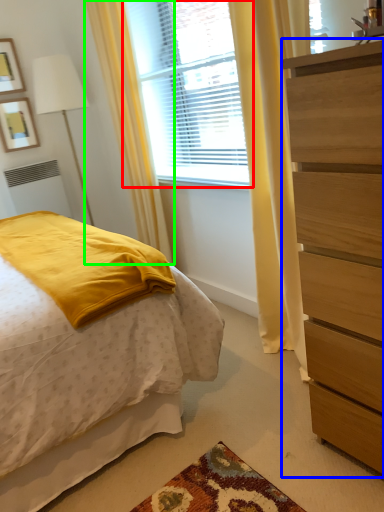
Question: Based on their relative distances, which object is nearer to window (highlighted by a red box)? Choose from chest of drawers (highlighted by a blue box) and curtain (highlighted by a green box).

Choices:
 (A) chest of drawers
 (B) curtain

Answer: (B)